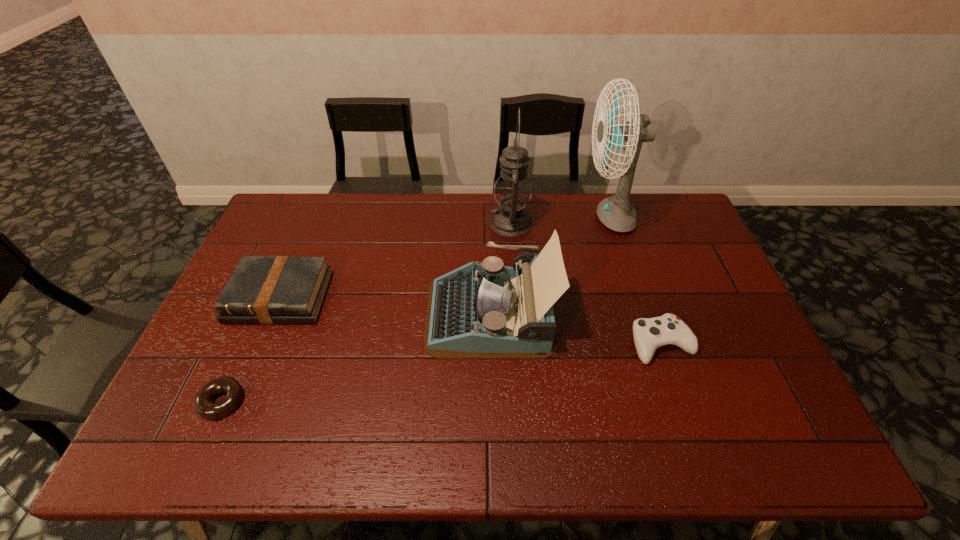
At what (x,y) coordinates should I click in order to perform the action: click on free spot that satisfies the following two spatial constraints: 1. on the front-facing side of the second shortest object; 2. on the left side of the fan. Please return your answer as a coordinate pair (x, y). The image size is (960, 540). Looking at the image, I should click on (650, 343).

Where is `free space that satisfies the following two spatial constraints: 1. on the front-facing side of the fan; 2. on the spine side of the fourth tallest object`? Image resolution: width=960 pixels, height=540 pixels. free space that satisfies the following two spatial constraints: 1. on the front-facing side of the fan; 2. on the spine side of the fourth tallest object is located at coordinates (635, 297).